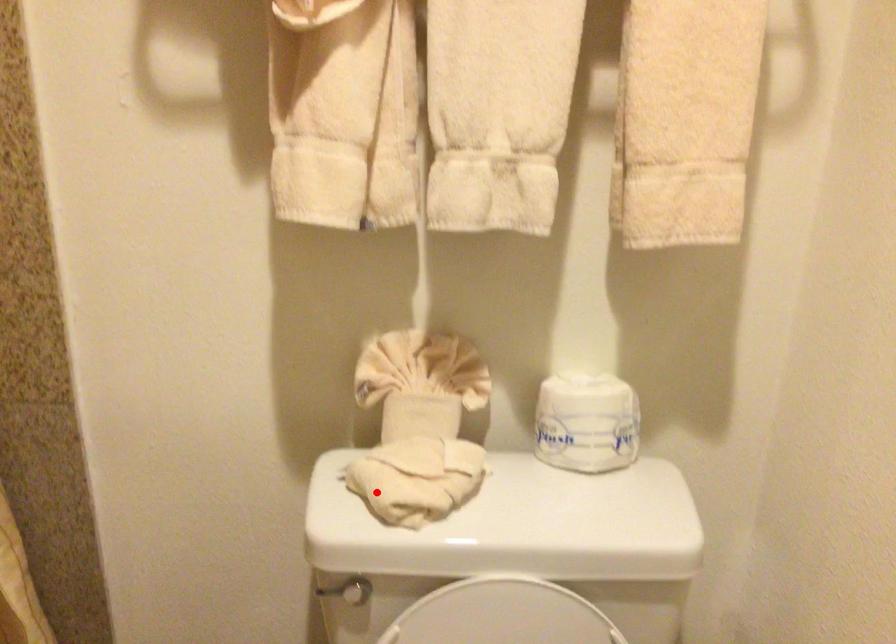
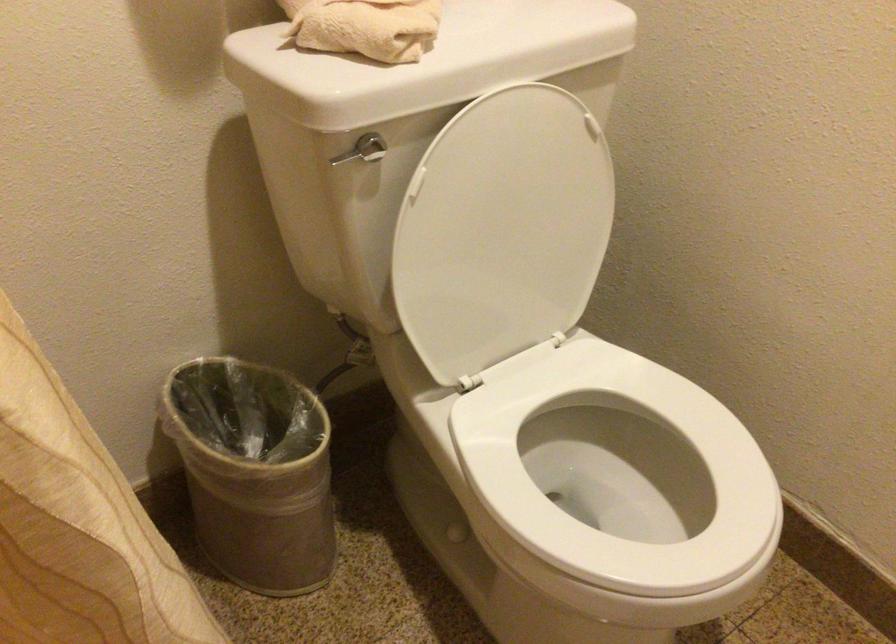
Question: I am providing you with two images of the same scene from different viewpoints. Image1 has a red point marked. In image2, the corresponding 3D location appears at what relative position? Reply with the corresponding letter.

Choices:
 (A) Closer
 (B) Farther

Answer: (A)